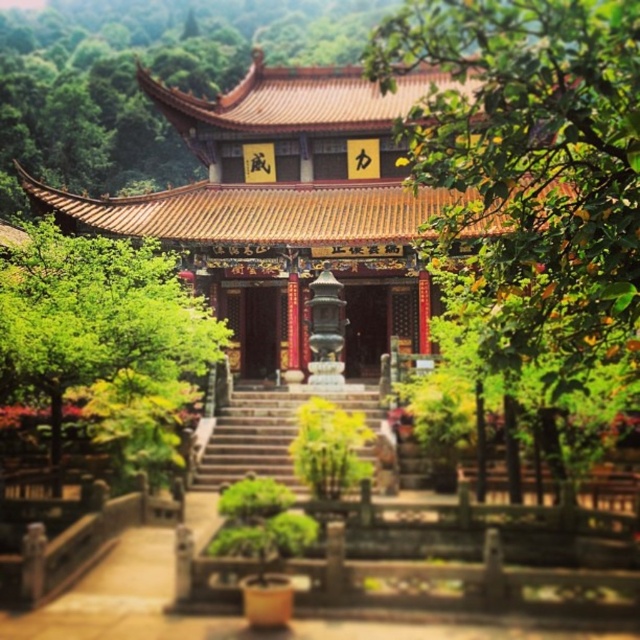
Who is taller, shiny gold roof at center or green leafy tree at left?

With more height is shiny gold roof at center.

What do you see at coordinates (285, 208) in the screenshot? I see `shiny gold roof at center` at bounding box center [285, 208].

I want to click on shiny gold roof at center, so coord(285,208).

Describe the element at coordinates (104, 336) in the screenshot. Image resolution: width=640 pixels, height=640 pixels. I see `green leafy tree at left` at that location.

Is the position of green leafy tree at left less distant than that of stone stairs at center?

Yes, green leafy tree at left is closer to the viewer.

Where is `green leafy tree at left`? The width and height of the screenshot is (640, 640). green leafy tree at left is located at coordinates (104, 336).

Locate an element on the screen. The image size is (640, 640). green leafy tree at left is located at coordinates (104, 336).

Which is more to the right, shiny gold roof at center or stone stairs at center?

Positioned to the right is shiny gold roof at center.

Does shiny gold roof at center have a greater height compared to stone stairs at center?

Yes, shiny gold roof at center is taller than stone stairs at center.

Based on the photo, measure the distance between shiny gold roof at center and camera.

shiny gold roof at center and camera are 14.09 meters apart from each other.

Locate an element on the screen. Image resolution: width=640 pixels, height=640 pixels. shiny gold roof at center is located at coordinates (285, 208).